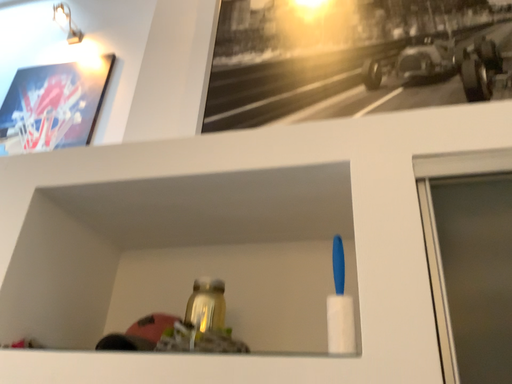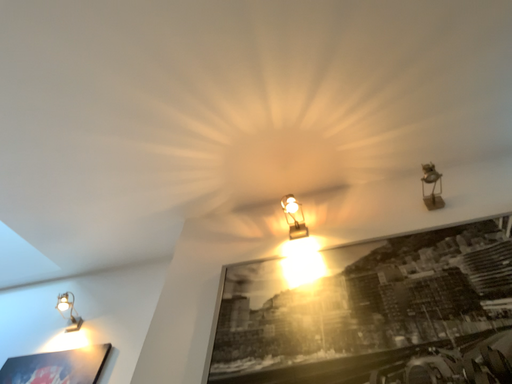
Question: Which way did the camera rotate in the video?

Choices:
 (A) rotated upward
 (B) rotated downward

Answer: (A)